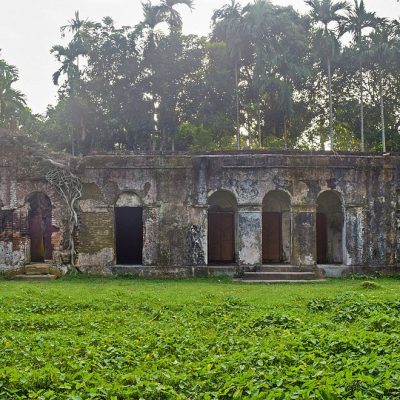
I want to click on doorway, so click(222, 239), click(273, 236), click(333, 240), click(129, 241), click(40, 234).